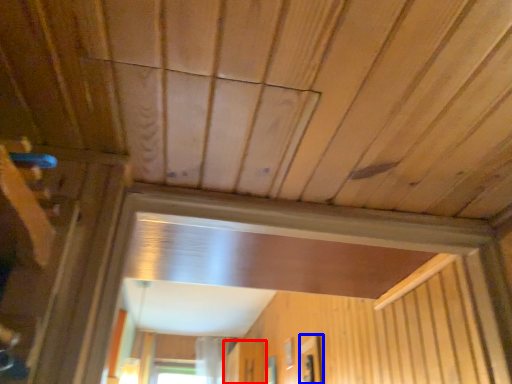
Question: Which object is closer to the camera taking this photo, screen door (highlighted by a red box) or window (highlighted by a blue box)?

Choices:
 (A) screen door
 (B) window

Answer: (B)